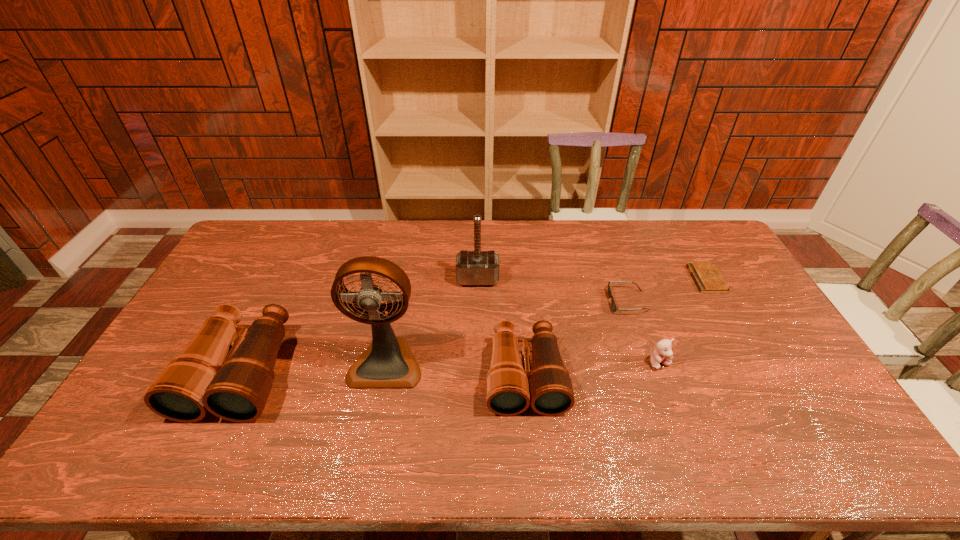
The image size is (960, 540). Find the location of `the sixth object from right to left`. the sixth object from right to left is located at coordinates (388, 362).

Where is `blank space located on the spine side of the diary`? blank space located on the spine side of the diary is located at coordinates click(x=594, y=279).

At what (x,y) coordinates should I click in order to perform the action: click on vacant space located 0.140m on the spine side of the diary. Please return your answer as a coordinate pair (x, y). Looking at the image, I should click on (652, 279).

In order to click on vacant position located on the spine side of the diary in this screenshot , I will do `click(588, 279)`.

I want to click on vacant area located 0.230m on the front-facing side of the sunglasses, so click(539, 301).

Identify the location of free spot located on the front-facing side of the sunglasses. (533, 301).

What are the coordinates of `vacant space situated on the front-facing side of the sunglasses` in the screenshot? It's located at click(x=542, y=301).

Image resolution: width=960 pixels, height=540 pixels. What are the coordinates of `free point located at the face of the third shortest object` in the screenshot? It's located at (680, 417).

You are a GUI agent. You are given a task and a screenshot of the screen. Output one action in this format:
    pyautogui.click(x=<x>, y=<y>)
    Task: Click on the vacant space located 0.360m on the left of the second tallest object
    The height and width of the screenshot is (540, 960).
    Given the screenshot: What is the action you would take?
    pyautogui.click(x=352, y=279)

Find the location of a particular element. vacant space located on the front-facing side of the second object from left to right is located at coordinates (378, 405).